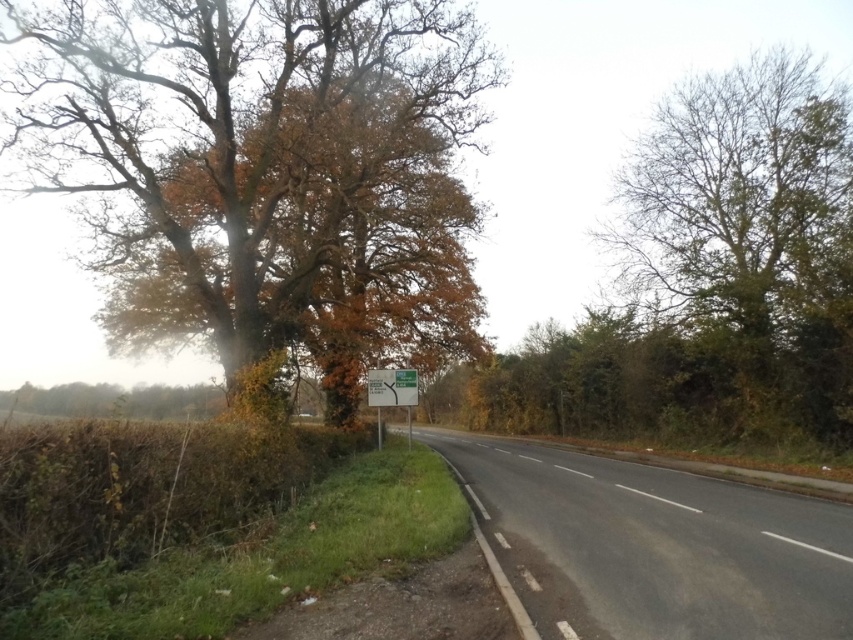
In the scene shown: You are driving a car and see the black asphalt highway at center and the white plastic sign at center ahead. Which object is higher in height?

The black asphalt highway at center is taller than the white plastic sign at center.

You are driving along the rural road and see the bare branches tree at right and the green plastic sign at center. Which object is positioned to the right of the other?

The bare branches tree at right is to the right of the green plastic sign at center.

You are standing at the center of the road and want to pick up the autumn leaves wood at left. In which direction should you walk to reach it?

You should walk to the left direction to reach the autumn leaves wood at left since it is located at point (263, 172) which is on the left side of the road.